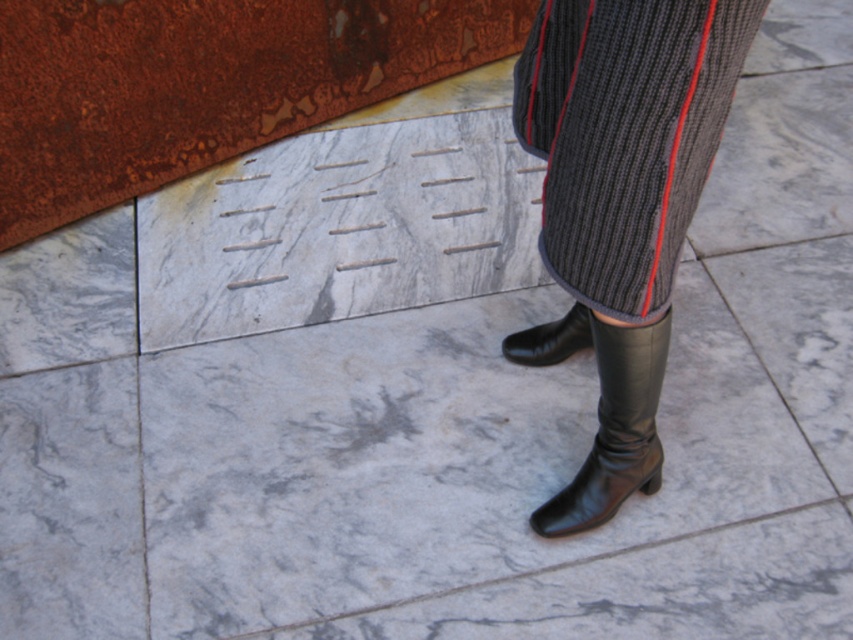
You are a fashion designer analyzing the image. You need to determine the spatial arrangement of the ribbed wool pants at center and the black leather boot at lower center for a design sketch. Which object is positioned to the right side in the image?

The black leather boot at lower center is positioned to the right side in the image because the ribbed wool pants at center is to the left of it.

You are a photographer trying to capture the best angle of the person standing on the tiles. You notice two points marked on the image. Which point, point (682, 172) or point (534, 516), is closer to you?

Point (682, 172) is closer to the viewer than point (534, 516).